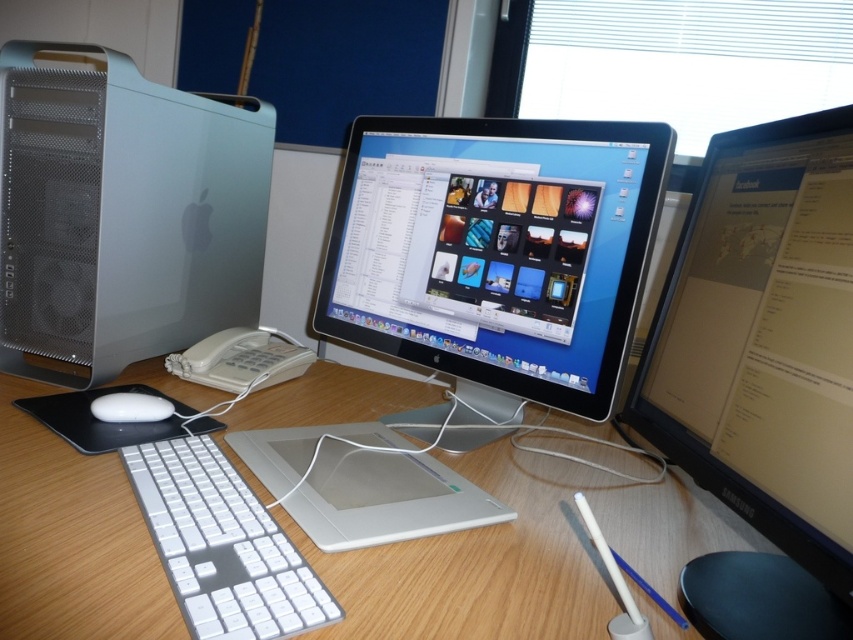
You are organizing cables for a tech setup. You need to connect a new USB device to the computer. Which device, the satin black monitor at center or the satin silver computer at left, should you plug the USB into?

You should plug the USB into the satin silver computer at left because the satin black monitor at center is in front of it and likely not the main computer for connecting peripherals.

You are setting up a new monitor in your home office and want to place it exactly where the satin black monitor at center is located. What are the coordinates for positioning the new monitor?

The coordinates for positioning the new monitor should be set to point (x=496, y=257), as that is where the satin black monitor at center is located.